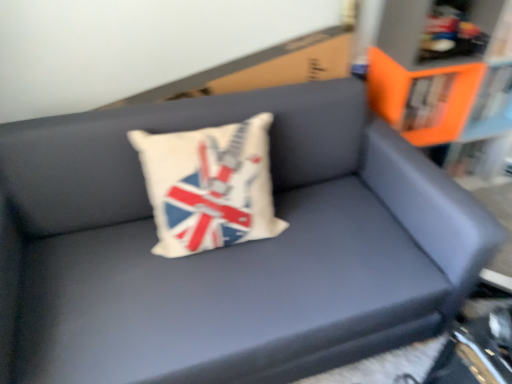
Describe the element at coordinates (447, 81) in the screenshot. I see `orange plastic bookcase at upper right` at that location.

Where is `orange plastic bookcase at upper right`? The width and height of the screenshot is (512, 384). orange plastic bookcase at upper right is located at coordinates click(x=447, y=81).

The image size is (512, 384). What are the coordinates of `white fabric pillow at center` in the screenshot? It's located at (209, 186).

Describe the element at coordinates (209, 186) in the screenshot. This screenshot has height=384, width=512. I see `white fabric pillow at center` at that location.

Where is `orange plastic bookcase at upper right`? orange plastic bookcase at upper right is located at coordinates (447, 81).

Would you say white fabric pillow at center is to the left or to the right of orange plastic bookcase at upper right in the picture?

white fabric pillow at center is to the left of orange plastic bookcase at upper right.

Which object is further away from the camera, white fabric pillow at center or orange plastic bookcase at upper right?

orange plastic bookcase at upper right is further from the camera.

Does point (242, 132) appear closer or farther from the camera than point (394, 41)?

Point (242, 132) appears to be closer to the viewer than point (394, 41).

Looking at this image, from the image's perspective, between white fabric pillow at center and orange plastic bookcase at upper right, which one is located above?

orange plastic bookcase at upper right.

From a real-world perspective, which object rests below the other?

orange plastic bookcase at upper right is physically lower.

Is white fabric pillow at center thinner than orange plastic bookcase at upper right?

Yes, white fabric pillow at center is thinner than orange plastic bookcase at upper right.

Who is shorter, white fabric pillow at center or orange plastic bookcase at upper right?

white fabric pillow at center is shorter.

Can you confirm if white fabric pillow at center is bigger than orange plastic bookcase at upper right?

No.

Which is correct: white fabric pillow at center is inside orange plastic bookcase at upper right, or outside of it?

white fabric pillow at center lies outside orange plastic bookcase at upper right.

Is white fabric pillow at center in contact with orange plastic bookcase at upper right?

There is a gap between white fabric pillow at center and orange plastic bookcase at upper right.

Could you tell me if white fabric pillow at center is turned towards orange plastic bookcase at upper right?

No, white fabric pillow at center is not oriented towards orange plastic bookcase at upper right.

You are a GUI agent. You are given a task and a screenshot of the screen. Output one action in this format:
    pyautogui.click(x=<x>, y=<y>)
    Task: Click on the bookcase lying on the right of white fabric pillow at center
    
    Given the screenshot: What is the action you would take?
    pyautogui.click(x=447, y=81)

Does orange plastic bookcase at upper right appear on the left side of white fabric pillow at center?

Incorrect, orange plastic bookcase at upper right is not on the left side of white fabric pillow at center.

Is orange plastic bookcase at upper right closer to camera compared to white fabric pillow at center?

No, orange plastic bookcase at upper right is further to the viewer.

Which point is more forward, (x=474, y=55) or (x=238, y=167)?

The point (x=238, y=167) is closer to the camera.

From the image's perspective, which object appears higher, orange plastic bookcase at upper right or white fabric pillow at center?

orange plastic bookcase at upper right appears higher in the image.

From a real-world perspective, which is physically below, orange plastic bookcase at upper right or white fabric pillow at center?

In real-world perspective, orange plastic bookcase at upper right is lower.

Is orange plastic bookcase at upper right wider or thinner than white fabric pillow at center?

Clearly, orange plastic bookcase at upper right has more width compared to white fabric pillow at center.

Between orange plastic bookcase at upper right and white fabric pillow at center, which one has more height?

Standing taller between the two is orange plastic bookcase at upper right.

Considering the sizes of objects orange plastic bookcase at upper right and white fabric pillow at center in the image provided, who is bigger, orange plastic bookcase at upper right or white fabric pillow at center?

orange plastic bookcase at upper right is bigger.

Is white fabric pillow at center a part of orange plastic bookcase at upper right?

No, white fabric pillow at center is not inside orange plastic bookcase at upper right.

Is orange plastic bookcase at upper right touching white fabric pillow at center?

No, orange plastic bookcase at upper right is not making contact with white fabric pillow at center.

Is orange plastic bookcase at upper right looking in the opposite direction of white fabric pillow at center?

No, orange plastic bookcase at upper right's orientation is not away from white fabric pillow at center.

From the picture: How many degrees apart are the facing directions of orange plastic bookcase at upper right and white fabric pillow at center?

orange plastic bookcase at upper right and white fabric pillow at center are facing 0.919 degrees away from each other.

The width and height of the screenshot is (512, 384). In order to click on bookcase behind the white fabric pillow at center in this screenshot , I will do `click(447, 81)`.

In the image, there is a white fabric pillow at center. Where is `bookcase below it (from a real-world perspective)`? The width and height of the screenshot is (512, 384). bookcase below it (from a real-world perspective) is located at coordinates (447, 81).

Locate an element on the screen. This screenshot has width=512, height=384. pillow on the left of orange plastic bookcase at upper right is located at coordinates (209, 186).